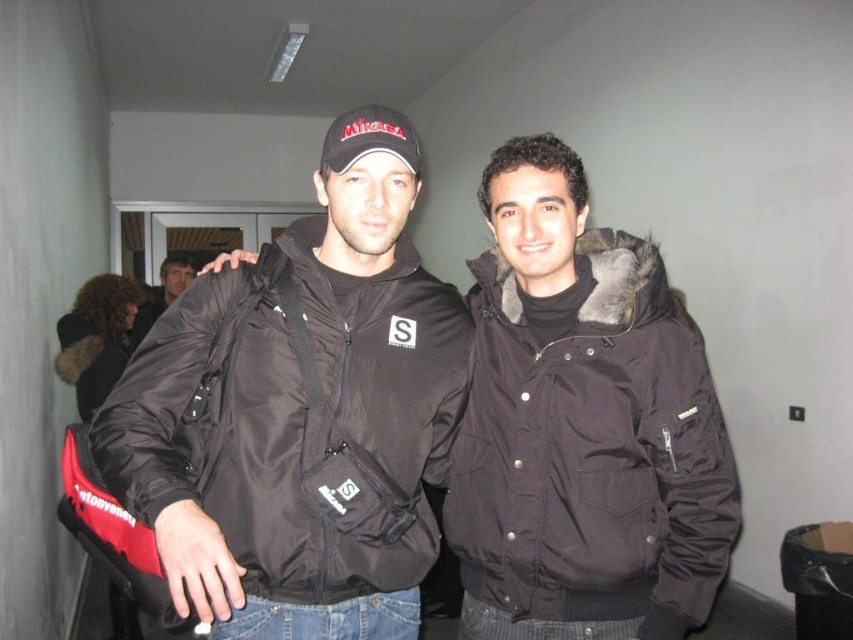
You are standing in front of the two people in the image. You want to touch the point at coordinate [296,417]. Which person should you approach to reach that point?

The point at coordinate [296,417] is located on the black synthetic jacket at center, so you should approach the person wearing the black synthetic jacket at center to reach that point.